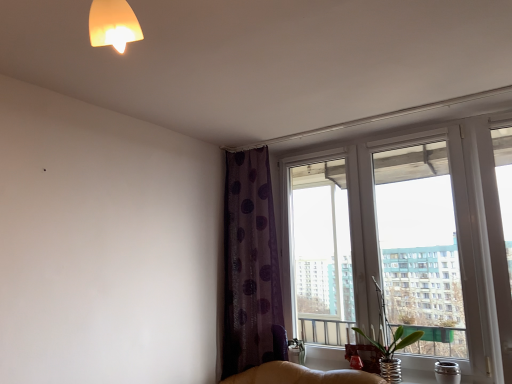
Question: Can you confirm if transparent glass window at upper right is wider than purple dotted fabric at upper center?

Choices:
 (A) yes
 (B) no

Answer: (B)

Question: Is transparent glass window at upper right closer to the viewer compared to purple dotted fabric at upper center?

Choices:
 (A) no
 (B) yes

Answer: (B)

Question: Is transparent glass window at upper right bigger than purple dotted fabric at upper center?

Choices:
 (A) no
 (B) yes

Answer: (B)

Question: Does transparent glass window at upper right appear on the right side of purple dotted fabric at upper center?

Choices:
 (A) no
 (B) yes

Answer: (B)

Question: Does transparent glass window at upper right lie behind purple dotted fabric at upper center?

Choices:
 (A) yes
 (B) no

Answer: (B)

Question: Considering their positions, is purple dotted fabric at upper center located in front of or behind green glass vase at window?

Choices:
 (A) front
 (B) behind

Answer: (B)

Question: Considering the positions of purple dotted fabric at upper center and green glass vase at window in the image, is purple dotted fabric at upper center taller or shorter than green glass vase at window?

Choices:
 (A) short
 (B) tall

Answer: (B)

Question: Does point (x=267, y=231) appear closer or farther from the camera than point (x=382, y=324)?

Choices:
 (A) farther
 (B) closer

Answer: (A)

Question: From the image's perspective, is purple dotted fabric at upper center located above or below green glass vase at window?

Choices:
 (A) below
 (B) above

Answer: (B)

Question: From the image's perspective, is green glass vase at window positioned above or below purple dotted fabric at upper center?

Choices:
 (A) below
 (B) above

Answer: (A)

Question: Is point (392, 331) closer or farther from the camera than point (254, 198)?

Choices:
 (A) farther
 (B) closer

Answer: (A)

Question: In terms of height, does green glass vase at window look taller or shorter compared to purple dotted fabric at upper center?

Choices:
 (A) tall
 (B) short

Answer: (B)

Question: From a real-world perspective, is green glass vase at window above or below purple dotted fabric at upper center?

Choices:
 (A) above
 (B) below

Answer: (B)

Question: Choose the correct answer: Is transparent glass window at upper right inside green glass vase at window or outside it?

Choices:
 (A) outside
 (B) inside

Answer: (A)

Question: From the image's perspective, is transparent glass window at upper right positioned above or below green glass vase at window?

Choices:
 (A) below
 (B) above

Answer: (B)